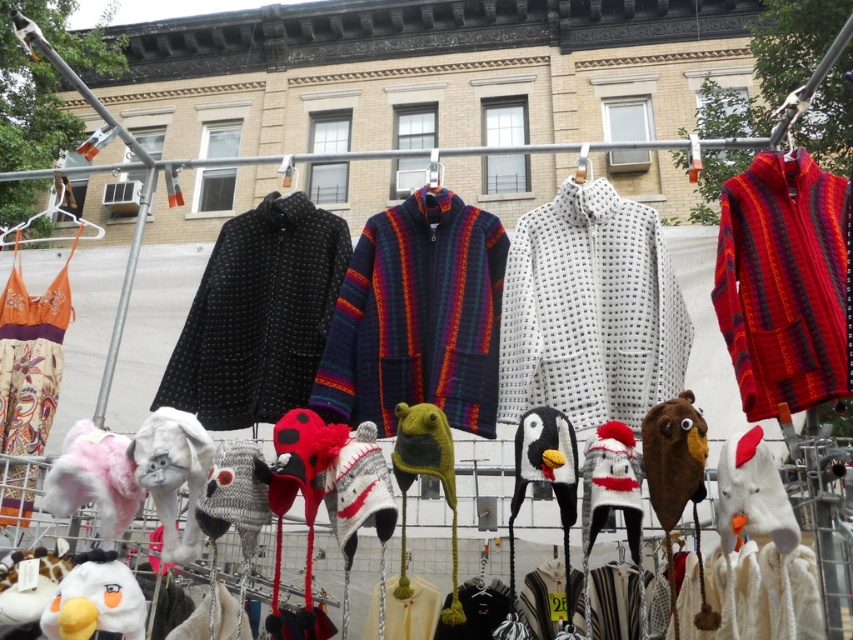
You are a customer at the market and want to buy the white plush chicken at lower right and the knitted wool penguin at center. If you want to place both items in a bag that can only hold items arranged side by side, which item should you place closer to the opening of the bag to easily access them?

The white plush chicken at lower right should be placed closer to the opening of the bag because it is positioned on the right side of the knitted wool penguin at center, so it would naturally be closer to the opening when arranging them side by side.

You are a customer at the market who wants to buy a gift for your friend. You see the white textured sweater at center and the white plush dog at lower left. Which item has a greater width?

The white textured sweater at center has a greater width than the white plush dog at lower left.